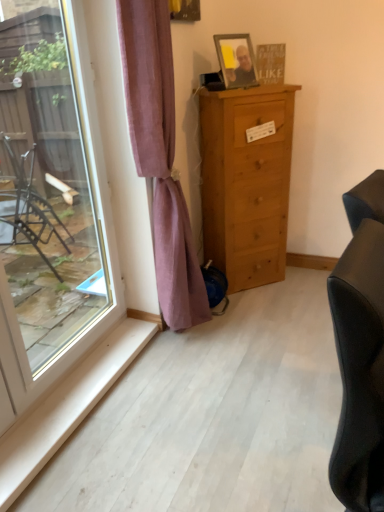
Question: Is purple velvet curtain at center positioned behind transparent glass window at left?

Choices:
 (A) no
 (B) yes

Answer: (B)

Question: Is purple velvet curtain at center positioned with its back to transparent glass window at left?

Choices:
 (A) yes
 (B) no

Answer: (B)

Question: Is transparent glass window at left inside purple velvet curtain at center?

Choices:
 (A) yes
 (B) no

Answer: (B)

Question: Does purple velvet curtain at center have a greater width compared to transparent glass window at left?

Choices:
 (A) no
 (B) yes

Answer: (B)

Question: Can you confirm if purple velvet curtain at center is bigger than transparent glass window at left?

Choices:
 (A) yes
 (B) no

Answer: (A)

Question: From a real-world perspective, relative to purple velvet curtain at center, is black leather studio couch at right vertically above or below?

Choices:
 (A) below
 (B) above

Answer: (A)

Question: Is black leather studio couch at right taller or shorter than purple velvet curtain at center?

Choices:
 (A) tall
 (B) short

Answer: (B)

Question: Which is correct: black leather studio couch at right is inside purple velvet curtain at center, or outside of it?

Choices:
 (A) outside
 (B) inside

Answer: (A)

Question: From the image's perspective, is black leather studio couch at right above or below purple velvet curtain at center?

Choices:
 (A) below
 (B) above

Answer: (A)

Question: Does point (377, 458) appear closer or farther from the camera than point (274, 208)?

Choices:
 (A) farther
 (B) closer

Answer: (B)

Question: Is black leather studio couch at right wider or thinner than light brown wood chest of drawers at center?

Choices:
 (A) thin
 (B) wide

Answer: (A)

Question: Relative to light brown wood chest of drawers at center, is black leather studio couch at right in front or behind?

Choices:
 (A) behind
 (B) front

Answer: (B)

Question: Is black leather studio couch at right inside the boundaries of light brown wood chest of drawers at center, or outside?

Choices:
 (A) inside
 (B) outside

Answer: (B)

Question: Is point [x=220, y=227] closer or farther from the camera than point [x=140, y=52]?

Choices:
 (A) farther
 (B) closer

Answer: (A)

Question: From their relative heights in the image, would you say light brown wood chest of drawers at center is taller or shorter than purple velvet curtain at center?

Choices:
 (A) tall
 (B) short

Answer: (B)